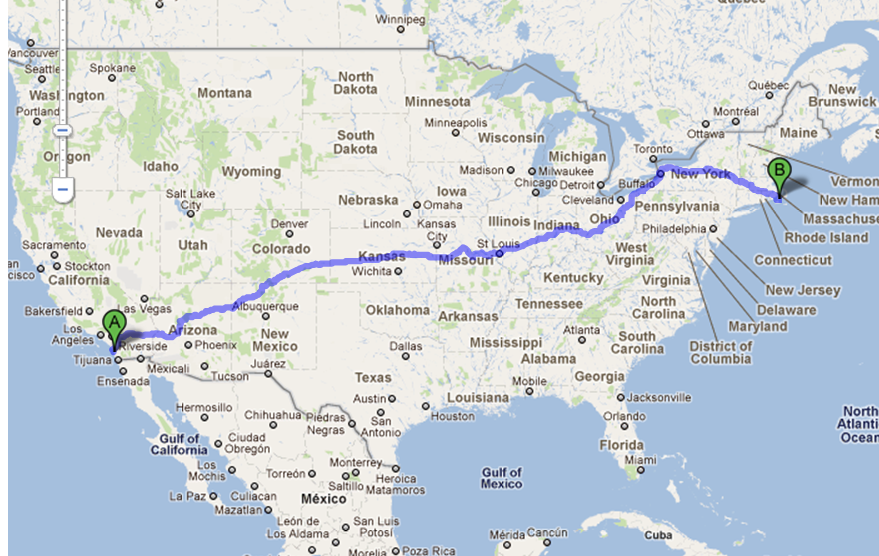
Identify the location of map. The image size is (879, 556). (185, 334).